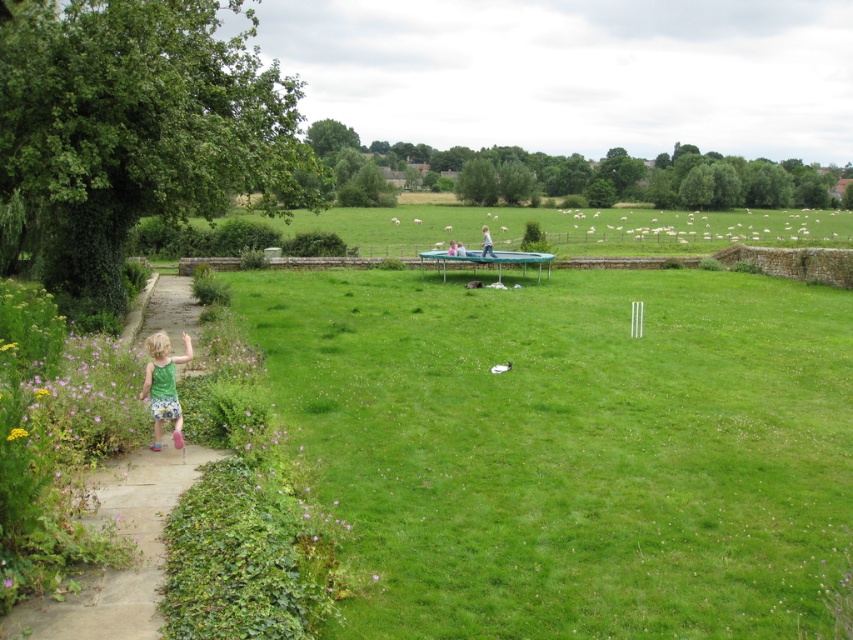
Question: Does green grassy field at center appear on the right side of brown stone path at left?

Choices:
 (A) yes
 (B) no

Answer: (A)

Question: Which point appears closest to the camera in this image?

Choices:
 (A) (820, 392)
 (B) (19, 435)

Answer: (B)

Question: Can you confirm if brown stone path at left is positioned to the right of green cotton dress at left?

Choices:
 (A) yes
 (B) no

Answer: (B)

Question: Is green grassy field at center bigger than yellow/yellowish-green textured flower at lower left?

Choices:
 (A) yes
 (B) no

Answer: (A)

Question: Which point is closer to the camera?

Choices:
 (A) click(x=299, y=340)
 (B) click(x=25, y=435)
 (C) click(x=151, y=412)

Answer: (B)

Question: Which object appears closest to the camera in this image?

Choices:
 (A) yellow/yellowish-green textured flower at lower left
 (B) green cotton dress at left

Answer: (A)